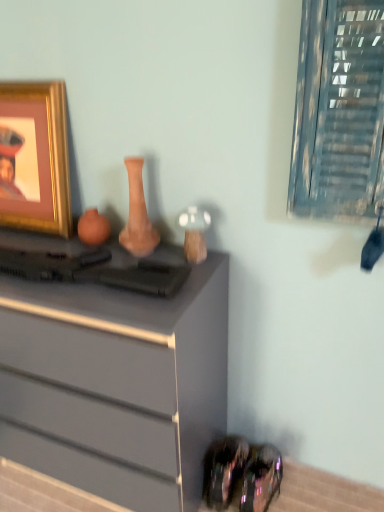
The image size is (384, 512). Identify the location of vacant region to the right of shiny black shoe at lower right. (301, 484).